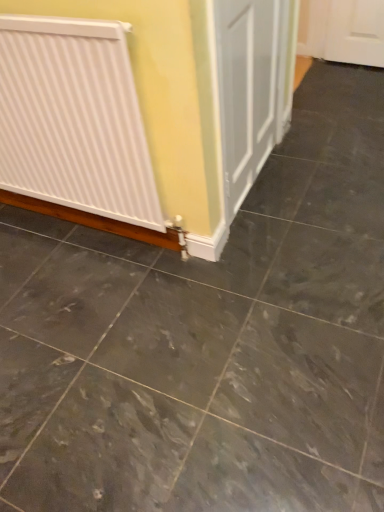
This screenshot has width=384, height=512. I want to click on free space in front of white ribbed radiator at left, so click(98, 331).